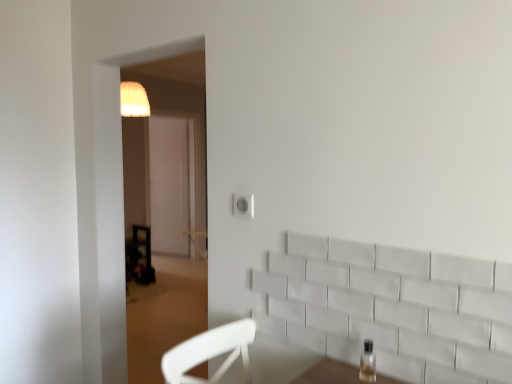
Question: Is white matte electric outlet at center thinner than clear glass bottle at lower right?

Choices:
 (A) no
 (B) yes

Answer: (B)

Question: Is white matte electric outlet at center further to camera compared to clear glass bottle at lower right?

Choices:
 (A) no
 (B) yes

Answer: (B)

Question: Considering the relative positions of white matte electric outlet at center and clear glass bottle at lower right in the image provided, is white matte electric outlet at center to the right of clear glass bottle at lower right from the viewer's perspective?

Choices:
 (A) yes
 (B) no

Answer: (B)

Question: Is white matte electric outlet at center positioned with its back to clear glass bottle at lower right?

Choices:
 (A) no
 (B) yes

Answer: (A)

Question: Is white matte electric outlet at center located outside clear glass bottle at lower right?

Choices:
 (A) no
 (B) yes

Answer: (B)

Question: From the image's perspective, is white matte electric outlet at center beneath clear glass bottle at lower right?

Choices:
 (A) yes
 (B) no

Answer: (B)

Question: Can you confirm if clear glass bottle at lower right is taller than white matte electric outlet at center?

Choices:
 (A) no
 (B) yes

Answer: (B)

Question: Is clear glass bottle at lower right closer to camera compared to white matte electric outlet at center?

Choices:
 (A) no
 (B) yes

Answer: (B)

Question: Can you confirm if clear glass bottle at lower right is shorter than white matte electric outlet at center?

Choices:
 (A) no
 (B) yes

Answer: (A)

Question: Is clear glass bottle at lower right not inside white matte electric outlet at center?

Choices:
 (A) no
 (B) yes

Answer: (B)

Question: Does clear glass bottle at lower right have a greater width compared to white matte electric outlet at center?

Choices:
 (A) yes
 (B) no

Answer: (A)

Question: Is clear glass bottle at lower right at the right side of white matte electric outlet at center?

Choices:
 (A) yes
 (B) no

Answer: (A)

Question: Is clear glass bottle at lower right situated inside white matte electric outlet at center or outside?

Choices:
 (A) inside
 (B) outside

Answer: (B)